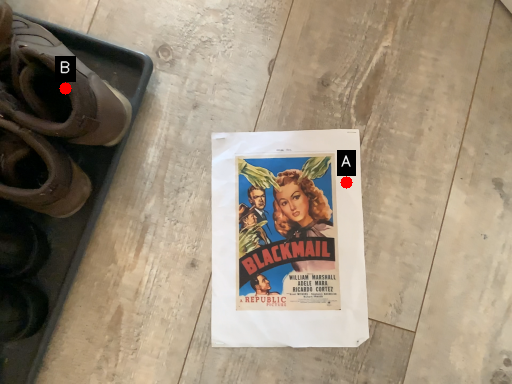
Question: Two points are circled on the image, labeled by A and B beside each circle. Which of the following is the closest to the observer?

Choices:
 (A) A is closer
 (B) B is closer

Answer: (B)